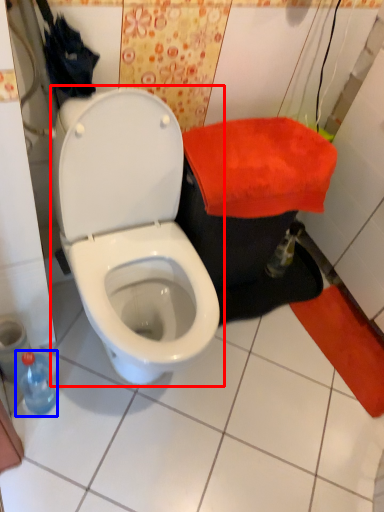
Question: Which object is further to the camera taking this photo, toilet (highlighted by a red box) or bottle (highlighted by a blue box)?

Choices:
 (A) toilet
 (B) bottle

Answer: (B)